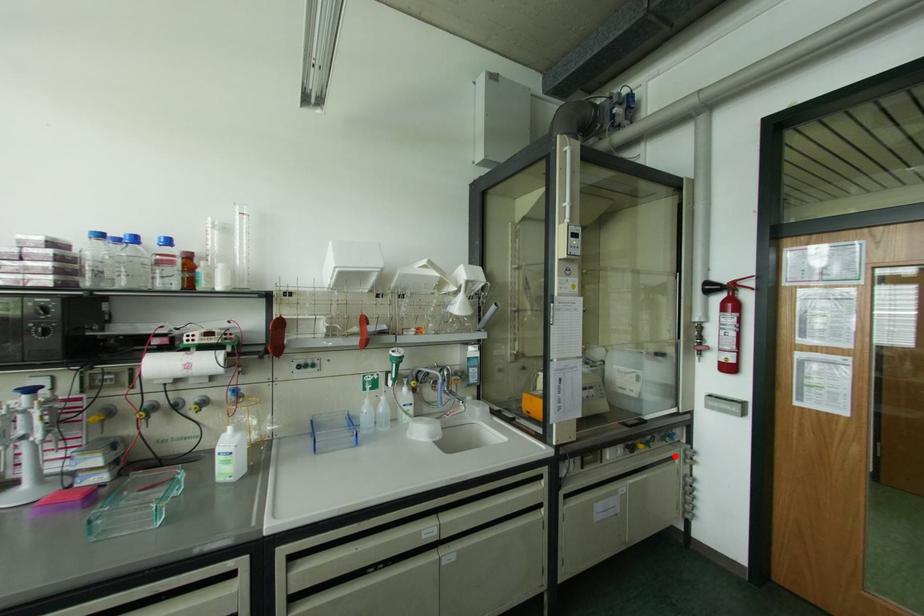
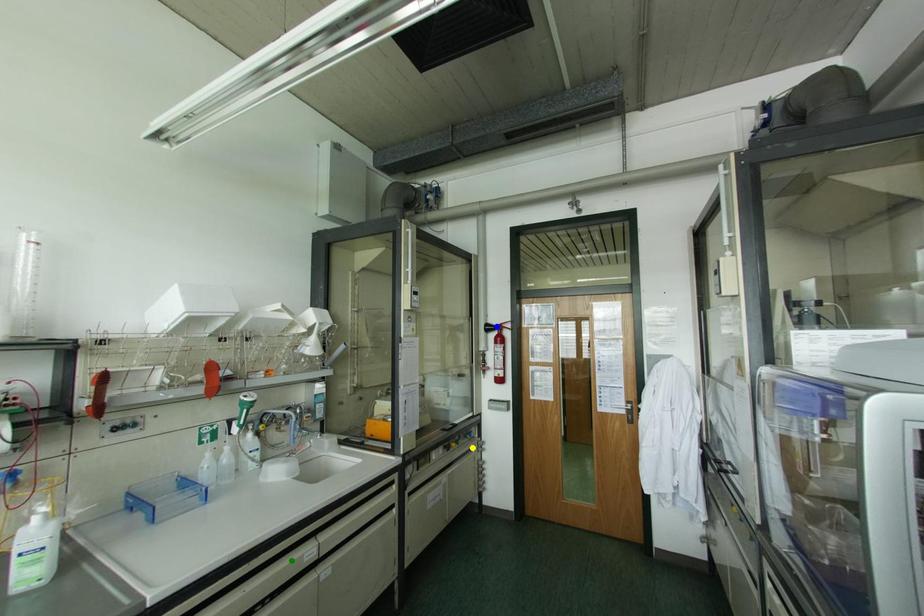
Question: I am providing you with two images of the same scene from different viewpoints. A red point is marked on the first image. You are given multiple points on the second image. Which point in image 2 is actually the same real-world point as the red point in image 1?

Choices:
 (A) yellow point
 (B) green point
 (C) blue point

Answer: (A)